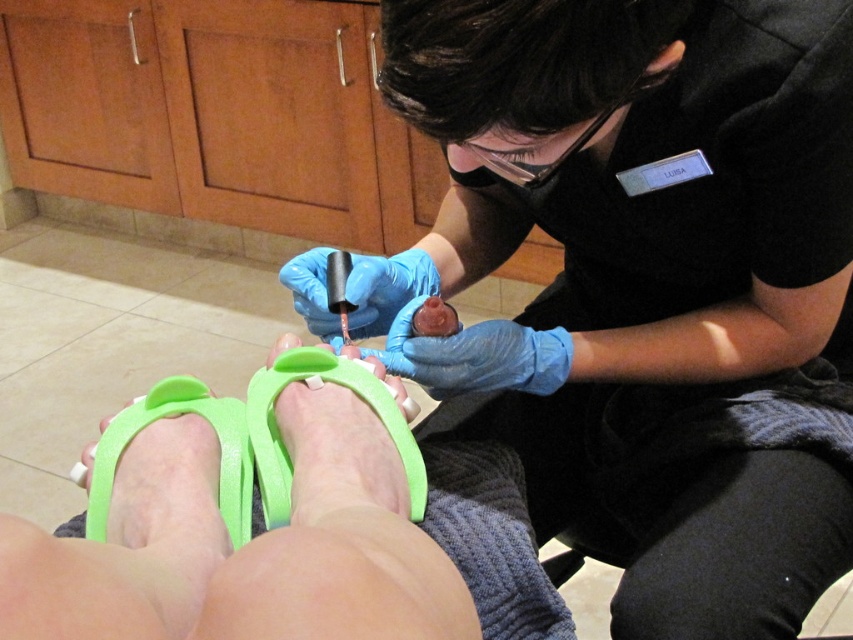
Question: Estimate the real-world distances between objects in this image. Which object is closer to the glossy nail polish at center?

Choices:
 (A) green rubber foot at lower center
 (B) green rubber foot at lower left
 (C) blue latex gloves at upper center

Answer: (A)

Question: Is green rubber sandals at lower center thinner than glossy nail polish at center?

Choices:
 (A) yes
 (B) no

Answer: (B)

Question: Which of these objects is positioned farthest from the glossy nail polish at center?

Choices:
 (A) green rubber sandals at lower center
 (B) blue latex gloves at upper center
 (C) green rubber foot at lower center
 (D) green rubber foot at lower left

Answer: (A)

Question: Does green rubber sandals at lower center appear over glossy nail polish at center?

Choices:
 (A) yes
 (B) no

Answer: (B)

Question: Which point appears farthest from the camera in this image?

Choices:
 (A) (527, 54)
 (B) (242, 506)
 (C) (148, 600)
 (D) (433, 282)

Answer: (D)

Question: Does green rubber foot at lower left appear over glossy nail polish at center?

Choices:
 (A) yes
 (B) no

Answer: (B)